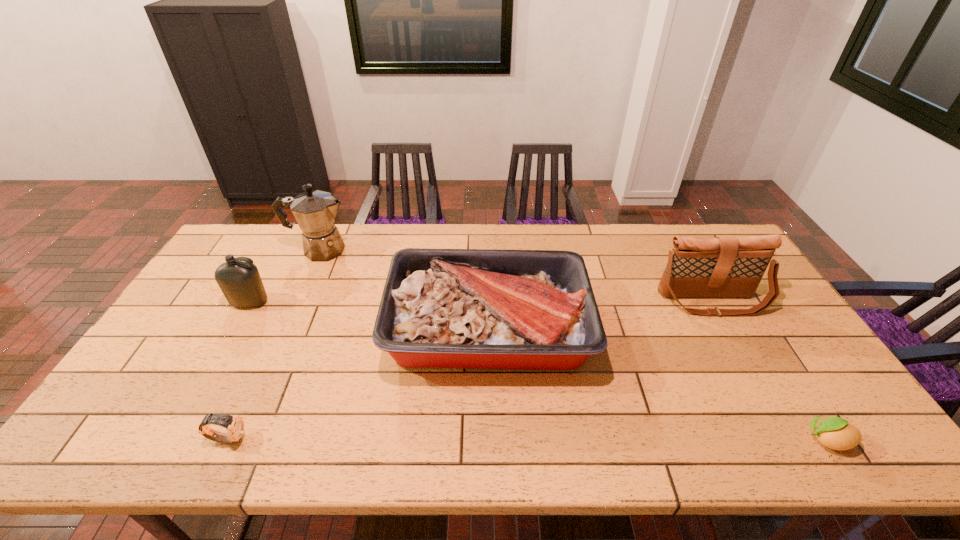
Find the location of a particular element. The image size is (960, 540). unoccupied area between the lemon and the shoulder bag is located at coordinates (769, 371).

Locate an element on the screen. This screenshot has width=960, height=540. free spot between the bottle and the coffeepot is located at coordinates (285, 276).

Locate an element on the screen. The width and height of the screenshot is (960, 540). vacant area between the watch and the bottle is located at coordinates (239, 370).

Select which object is the second closest to the shoulder bag. Please provide its 2D coordinates. Your answer should be formatted as a tuple, i.e. [(x, y)], where the tuple contains the x and y coordinates of a point satisfying the conditions above.

[(836, 433)]

In order to click on object identified as the fifth closest to the bottle in this screenshot , I will do pos(836,433).

The width and height of the screenshot is (960, 540). Find the location of `vacant space that satisfies the following two spatial constraints: 1. on the front-facing side of the shoulder bag; 2. on the face of the watch`. vacant space that satisfies the following two spatial constraints: 1. on the front-facing side of the shoulder bag; 2. on the face of the watch is located at coordinates [788, 438].

You are a GUI agent. You are given a task and a screenshot of the screen. Output one action in this format:
    pyautogui.click(x=<x>, y=<y>)
    Task: Click on the vacant space that satisfies the following two spatial constraints: 1. on the front-facing side of the second tallest object; 2. on the face of the watch
    This screenshot has height=540, width=960.
    Given the screenshot: What is the action you would take?
    pyautogui.click(x=788, y=438)